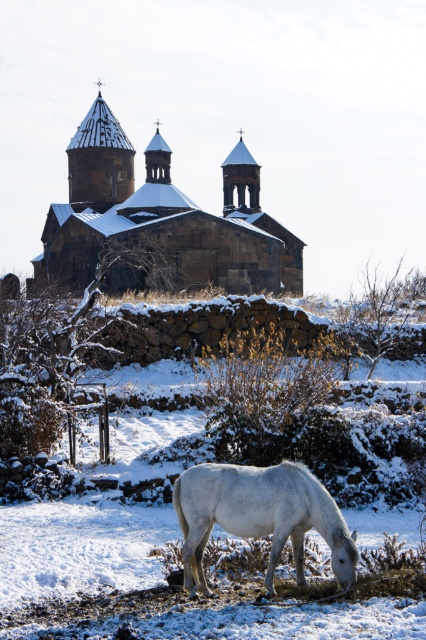
Between dark brown stone church at center and white matte horse at lower center, which one appears on the right side from the viewer's perspective?

white matte horse at lower center

Does dark brown stone church at center have a lesser height compared to white matte horse at lower center?

No, dark brown stone church at center is not shorter than white matte horse at lower center.

What do you see at coordinates (160, 221) in the screenshot? The image size is (426, 640). I see `dark brown stone church at center` at bounding box center [160, 221].

Where is `dark brown stone church at center`? dark brown stone church at center is located at coordinates pyautogui.click(x=160, y=221).